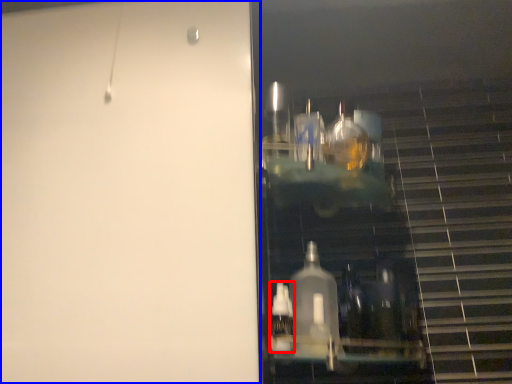
Question: Which of the following is the closest to the observer, bottle (highlighted by a red box) or door (highlighted by a blue box)?

Choices:
 (A) bottle
 (B) door

Answer: (B)